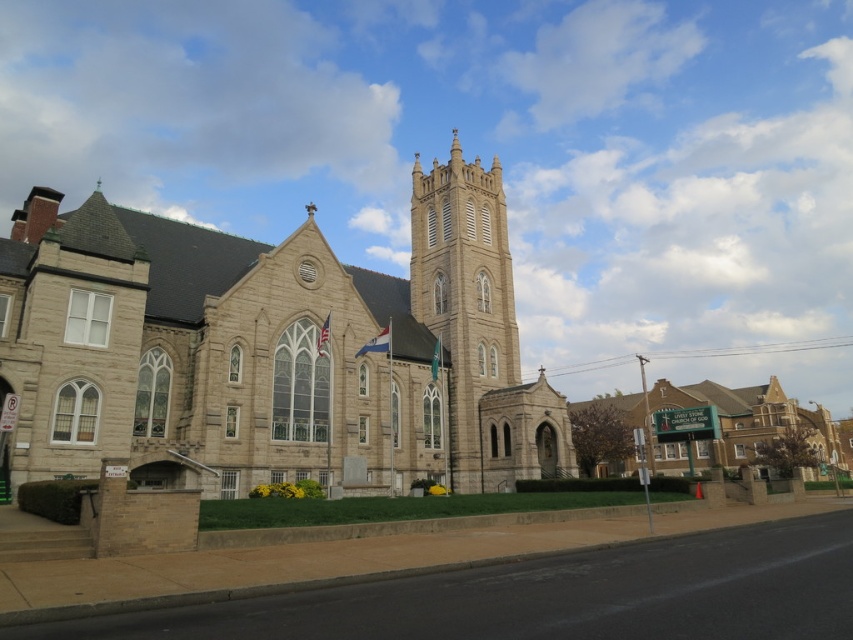
This screenshot has width=853, height=640. What do you see at coordinates (270, 349) in the screenshot? I see `beige stone church at center` at bounding box center [270, 349].

Does beige stone church at center have a greater width compared to beige stone tower at center?

Correct, the width of beige stone church at center exceeds that of beige stone tower at center.

Is point (264, 438) positioned before point (444, 324)?

Yes.

Identify the location of beige stone church at center. The image size is (853, 640). (270, 349).

Locate an element on the screen. beige stone church at center is located at coordinates (270, 349).

Consider the image. Does beige stone church at center have a smaller size compared to green signboard at center?

Yes, beige stone church at center is smaller than green signboard at center.

Where is `beige stone church at center`? This screenshot has width=853, height=640. beige stone church at center is located at coordinates (270, 349).

Does point (515, 352) lie in front of point (635, 412)?

Yes, point (515, 352) is in front of point (635, 412).

Is point (492, 328) positioned behind point (677, 406)?

No, (492, 328) is closer to viewer.

Does point (506, 376) come behind point (753, 417)?

No, it is in front of (753, 417).

Identify the location of beige stone tower at center. This screenshot has width=853, height=640. (466, 305).